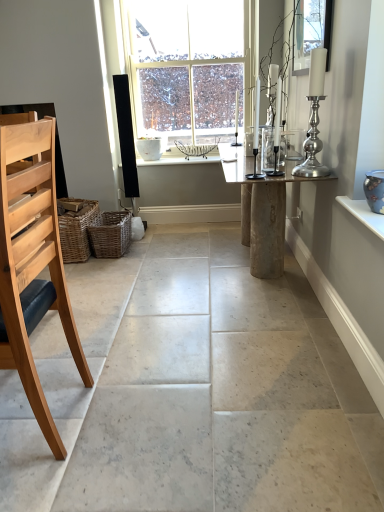
Where is `vacant region in front of woven brown basket at lower left, positioned as the first basket in right-to-left order`? vacant region in front of woven brown basket at lower left, positioned as the first basket in right-to-left order is located at coordinates (109, 267).